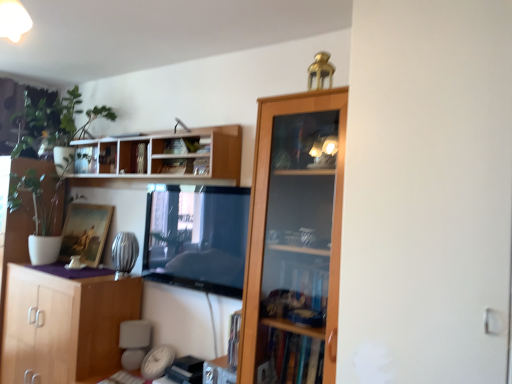
This screenshot has width=512, height=384. I want to click on matte wooden picture frame at center-left, so click(x=85, y=232).

Where is `wooden cabinet at lower left`? This screenshot has width=512, height=384. wooden cabinet at lower left is located at coordinates 65,325.

Where is `hardcover book at upper center, the 2th book in the right-to-left sequence`? hardcover book at upper center, the 2th book in the right-to-left sequence is located at coordinates (181, 166).

Locate an element on the screen. The width and height of the screenshot is (512, 384). matte wooden picture frame at center-left is located at coordinates (85, 232).

Measure the distance from matte wooden picture frame at center-left to hardcover book at upper center, which is the 1th book from right to left.

matte wooden picture frame at center-left is 1.03 meters from hardcover book at upper center, which is the 1th book from right to left.

Is matte wooden picture frame at center-left in contact with hardcover book at upper center, which is the 1th book from right to left?

No, matte wooden picture frame at center-left is not beside hardcover book at upper center, which is the 1th book from right to left.

Considering the sizes of objects matte wooden picture frame at center-left and hardcover book at upper center, which is the 1th book from right to left, in the image provided, who is thinner, matte wooden picture frame at center-left or hardcover book at upper center, which is the 1th book from right to left,?

Thinner between the two is matte wooden picture frame at center-left.

Which point is more distant from viewer, (53, 325) or (185, 160)?

The point (53, 325) is farther.

Where is `cabinetry below the hardcover book at upper center, the 2th book in the right-to-left sequence (from a real-world perspective)`? The height and width of the screenshot is (384, 512). cabinetry below the hardcover book at upper center, the 2th book in the right-to-left sequence (from a real-world perspective) is located at coordinates pyautogui.click(x=65, y=325).

Is wooden cabinet at lower left aimed at hardcover book at upper center, the 2th book when ordered from left to right?

No, wooden cabinet at lower left is not oriented towards hardcover book at upper center, the 2th book when ordered from left to right.

Between matte wooden picture frame at center-left and hardcover book at upper center, the 2th book in the right-to-left sequence, which one appears on the left side from the viewer's perspective?

From the viewer's perspective, matte wooden picture frame at center-left appears more on the left side.

Is matte wooden picture frame at center-left located outside hardcover book at upper center, the 2th book when ordered from left to right?

Absolutely, matte wooden picture frame at center-left is external to hardcover book at upper center, the 2th book when ordered from left to right.

Does point (106, 224) appear closer or farther from the camera than point (180, 158)?

Point (106, 224) is farther from the camera than point (180, 158).

From a real-world perspective, is matte wooden picture frame at center-left physically located above or below hardcover book at upper center, the 2th book when ordered from left to right?

matte wooden picture frame at center-left is below hardcover book at upper center, the 2th book when ordered from left to right.

Can you confirm if white wood shelves at upper center is shorter than white glossy screen door at right?

Yes, white wood shelves at upper center is shorter than white glossy screen door at right.

Visually, is white wood shelves at upper center positioned to the left or to the right of white glossy screen door at right?

In the image, white wood shelves at upper center appears on the left side of white glossy screen door at right.

Does point (217, 182) come behind point (402, 246)?

Yes, point (217, 182) is farther from viewer.

Consider the image. Is white wood shelves at upper center inside the boundaries of white glossy screen door at right, or outside?

white wood shelves at upper center is spatially situated outside white glossy screen door at right.

Is wooden cabinet at lower left to the left of wooden shelf at upper center from the viewer's perspective?

Correct, you'll find wooden cabinet at lower left to the left of wooden shelf at upper center.

The image size is (512, 384). Identify the location of cabinetry below the wooden shelf at upper center (from the image's perspective). (65, 325).

Can you see wooden cabinet at lower left touching wooden shelf at upper center?

No, wooden cabinet at lower left is not next to wooden shelf at upper center.

Is wooden cabinet at lower left facing towards wooden shelf at upper center?

No, wooden cabinet at lower left does not turn towards wooden shelf at upper center.

Would you say wooden shelf at upper center is to the left or to the right of wooden cabinet at lower left in the picture?

Based on their positions, wooden shelf at upper center is located to the right of wooden cabinet at lower left.

Who is taller, wooden shelf at upper center or wooden cabinet at lower left?

wooden cabinet at lower left is taller.

Is wooden shelf at upper center inside the boundaries of wooden cabinet at lower left, or outside?

wooden shelf at upper center is not enclosed by wooden cabinet at lower left.

What's the angular difference between wooden shelf at upper center and wooden cabinet at lower left's facing directions?

Answer: The facing directions of wooden shelf at upper center and wooden cabinet at lower left are 0.661 degrees apart.

Could you tell me if hardcover book at upper center, the 2th book in the right-to-left sequence, is facing wooden shelf at upper center?

No, hardcover book at upper center, the 2th book in the right-to-left sequence, is not facing towards wooden shelf at upper center.

Considering the sizes of objects hardcover book at upper center, the 2th book in the right-to-left sequence, and wooden shelf at upper center in the image provided, who is thinner, hardcover book at upper center, the 2th book in the right-to-left sequence, or wooden shelf at upper center?

hardcover book at upper center, the 2th book in the right-to-left sequence.

Which point is more distant from viewer, [208,161] or [83,145]?

The point [83,145] is behind.

Is hardcover book at upper center, the 2th book when ordered from left to right, shorter than wooden shelf at upper center?

Indeed, hardcover book at upper center, the 2th book when ordered from left to right, has a lesser height compared to wooden shelf at upper center.

From a real-world perspective, count 3rd books upward from the matte wooden picture frame at center-left and point to it. Please provide its 2D coordinates.

[(182, 146)]

The width and height of the screenshot is (512, 384). Identify the location of cabinetry lying below the hardcover book at upper center, the 2th book when ordered from left to right (from the image's perspective). (65, 325).

From the image, which object appears to be nearer to hardcover book at upper center, which is counted as the 3th book, starting from the left, white wood shelves at upper center or wooden cabinet at upper right?

Based on the image, white wood shelves at upper center appears to be nearer to hardcover book at upper center, which is counted as the 3th book, starting from the left.

Estimate the real-world distances between objects in this image. Which object is closer to hardcover book at upper center, the 2th book when ordered from left to right, wooden shelf at upper center or metallic silver book at upper center, the 1th book viewed from the left?

Based on the image, metallic silver book at upper center, the 1th book viewed from the left, appears to be nearer to hardcover book at upper center, the 2th book when ordered from left to right.

Which object lies nearer to the anchor point wooden cabinet at lower left, hardcover book at upper center, which is counted as the 3th book, starting from the left, or white wood shelves at upper center?

Based on the image, white wood shelves at upper center appears to be nearer to wooden cabinet at lower left.

Which object lies nearer to the anchor point hardcover book at upper center, the 2th book in the right-to-left sequence, metallic silver book at upper center, the 3th book when ordered from right to left, or wooden cabinet at upper right?

metallic silver book at upper center, the 3th book when ordered from right to left.

Which object lies further to the anchor point matte wooden picture frame at center-left, wooden cabinet at upper right or white wood shelves at upper center?

wooden cabinet at upper right is positioned further to the anchor matte wooden picture frame at center-left.

From the image, which object appears to be nearer to hardcover book at upper center, which is the 1th book from right to left, hardcover book at upper center, the 2th book when ordered from left to right, or wooden shelf at upper center?

Among the two, hardcover book at upper center, the 2th book when ordered from left to right, is located nearer to hardcover book at upper center, which is the 1th book from right to left.

Estimate the real-world distances between objects in this image. Which object is further from white glossy screen door at right, hardcover book at upper center, which is the 1th book from right to left, or hardcover book at upper center, the 2th book in the right-to-left sequence?

The object further to white glossy screen door at right is hardcover book at upper center, which is the 1th book from right to left.

Which object lies further to the anchor point white glossy screen door at right, wooden shelf at upper center or hardcover book at upper center, the 2th book when ordered from left to right?

The object further to white glossy screen door at right is wooden shelf at upper center.

Locate an element on the screen. The width and height of the screenshot is (512, 384). cupboard between wooden cabinet at lower left and white glossy screen door at right is located at coordinates (294, 232).

I want to click on picture frame between white wood shelves at upper center and wooden shelf at upper center from front to back, so click(x=85, y=232).

The width and height of the screenshot is (512, 384). I want to click on shelf between matte wooden picture frame at center-left and hardcover book at upper center, the 2th book in the right-to-left sequence, so click(x=166, y=156).

The height and width of the screenshot is (384, 512). What are the coordinates of `cabinet between matte wooden picture frame at center-left and hardcover book at upper center, which is the 1th book from right to left, from left to right` in the screenshot? It's located at (95, 157).